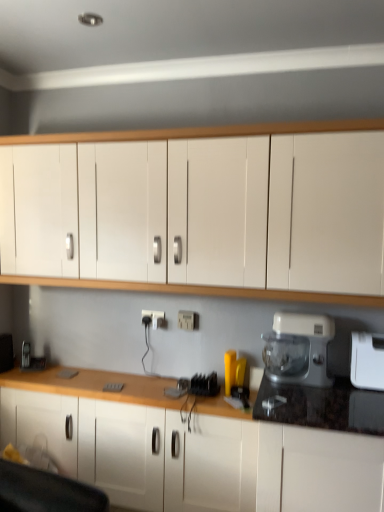
Question: Is white plastic electric outlet at center, arranged as the first electric outlet when viewed from the back, inside the boundaries of white plastic food processor at right, or outside?

Choices:
 (A) inside
 (B) outside

Answer: (B)

Question: Considering the positions of white plastic electric outlet at center, arranged as the 2th electric outlet when viewed from the right, and white plastic food processor at right in the image, is white plastic electric outlet at center, arranged as the 2th electric outlet when viewed from the right, taller or shorter than white plastic food processor at right?

Choices:
 (A) short
 (B) tall

Answer: (A)

Question: Considering the real-world distances, which object is closest to the white plastic electric outlet at center, arranged as the first electric outlet when viewed from the back?

Choices:
 (A) white plastic electric outlet at center, the 1th electric outlet from the front
 (B) white plastic toaster at right
 (C) white matte cabinet at upper center, which is the first cabinetry in top-to-bottom order
 (D) white plastic food processor at right
 (E) white matte cabinet at center, which is counted as the 2th cabinetry, starting from the top

Answer: (A)

Question: Considering the real-world distances, which object is farthest from the white plastic electric outlet at center, marked as the 1th electric outlet in a right-to-left arrangement?

Choices:
 (A) white plastic food processor at right
 (B) white matte cabinet at upper center, which is the first cabinetry in top-to-bottom order
 (C) white plastic toaster at right
 (D) white matte cabinet at center, which is counted as the 2th cabinetry, starting from the top
 (E) white plastic electric outlet at center, arranged as the first electric outlet when viewed from the back

Answer: (C)